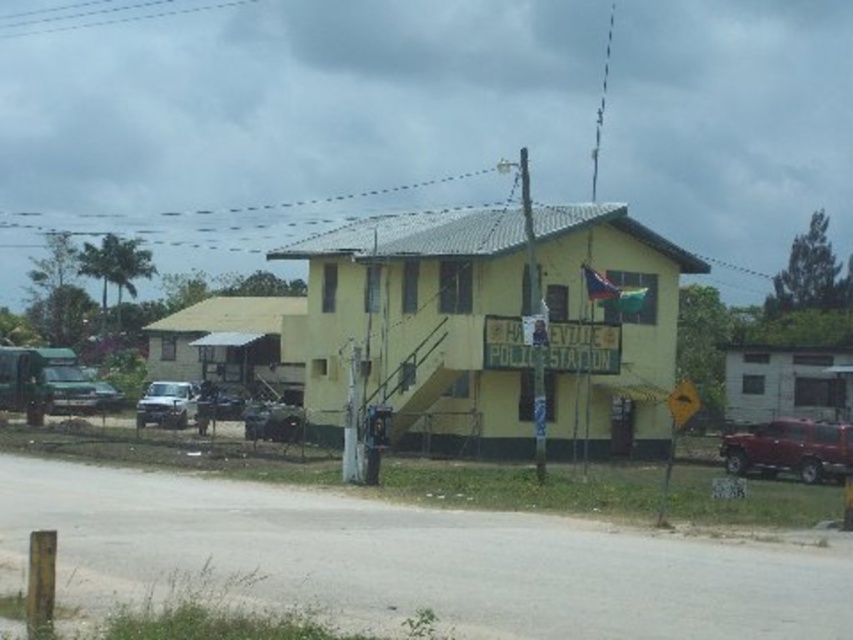
Question: Based on their relative distances, which object is nearer to the silver metallic truck at left?

Choices:
 (A) shiny red truck at right
 (B) metallic silver truck at center-left

Answer: (B)

Question: Is silver metallic truck at left bigger than metallic silver truck at center-left?

Choices:
 (A) no
 (B) yes

Answer: (B)

Question: Which is nearer to the metallic silver truck at center-left?

Choices:
 (A) silver metallic truck at left
 (B) shiny red truck at right

Answer: (A)

Question: Does shiny red truck at right have a greater width compared to metallic silver truck at center-left?

Choices:
 (A) yes
 (B) no

Answer: (B)

Question: Estimate the real-world distances between objects in this image. Which object is closer to the metallic silver truck at center-left?

Choices:
 (A) silver metallic truck at left
 (B) shiny red truck at right

Answer: (A)

Question: Can you confirm if silver metallic truck at left is positioned below metallic silver truck at center-left?

Choices:
 (A) no
 (B) yes

Answer: (A)